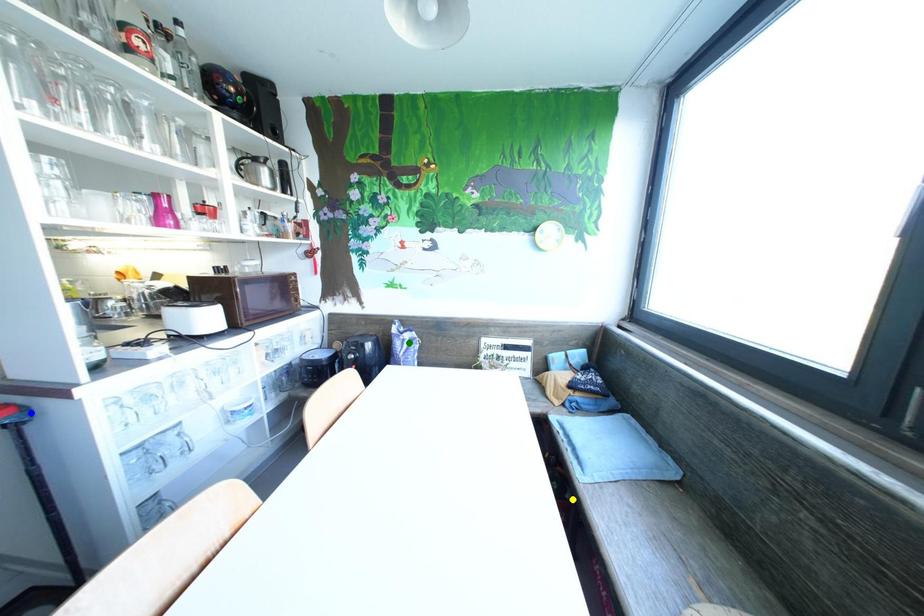
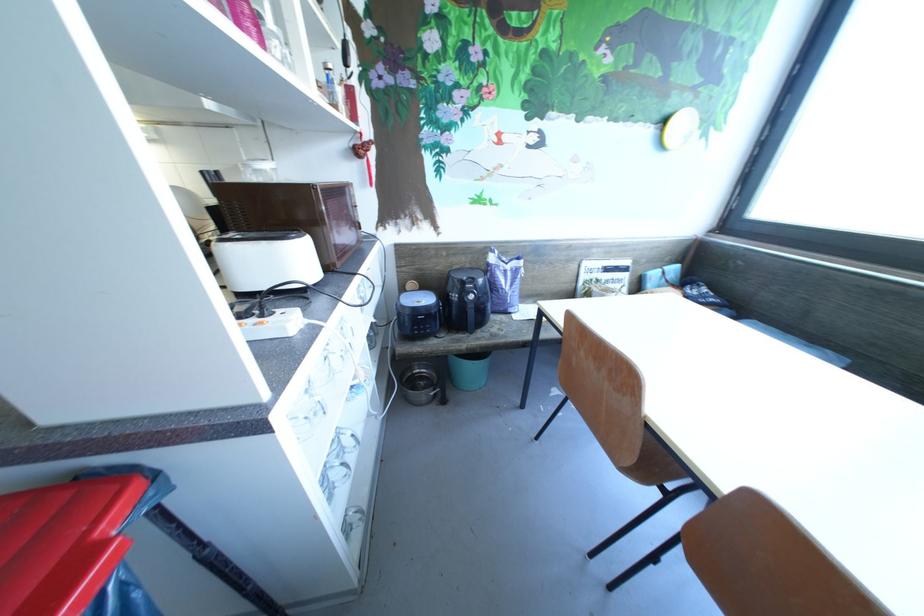
I am providing you with two images of the same scene from different viewpoints. Three points are marked in image1. Which point corresponds to a part or object that is occluded in image2?In image1, three points are marked. Which of them correspond to a part or object that is occluded in image2?Among the three points shown in image1, which one corresponds to a part or object that is no longer visible due to occlusion in image2?

yellow point cannot be seen in image2.